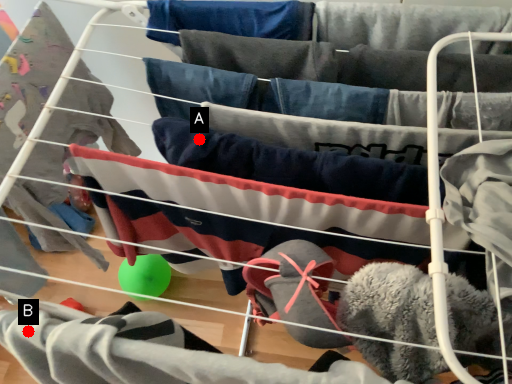
Question: Two points are circled on the image, labeled by A and B beside each circle. Which point is closer to the camera taking this photo?

Choices:
 (A) A is closer
 (B) B is closer

Answer: (B)